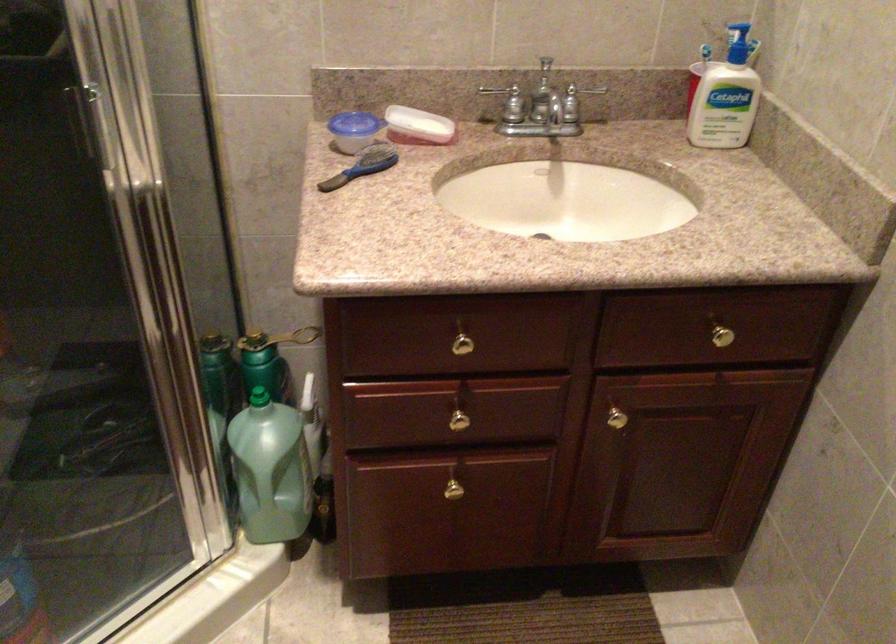
Where is `green bottle pump`? Image resolution: width=896 pixels, height=644 pixels. green bottle pump is located at coordinates [238, 399].